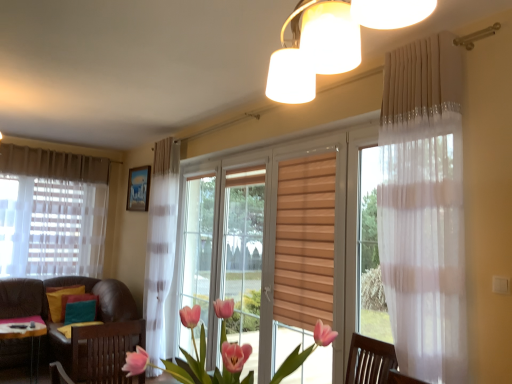
The width and height of the screenshot is (512, 384). What do you see at coordinates (52, 212) in the screenshot? I see `sheer white curtain at left` at bounding box center [52, 212].

Identify the location of sheer white curtain at left. This screenshot has height=384, width=512. (52, 212).

The height and width of the screenshot is (384, 512). In order to click on sheer white curtain at left in this screenshot , I will do `click(52, 212)`.